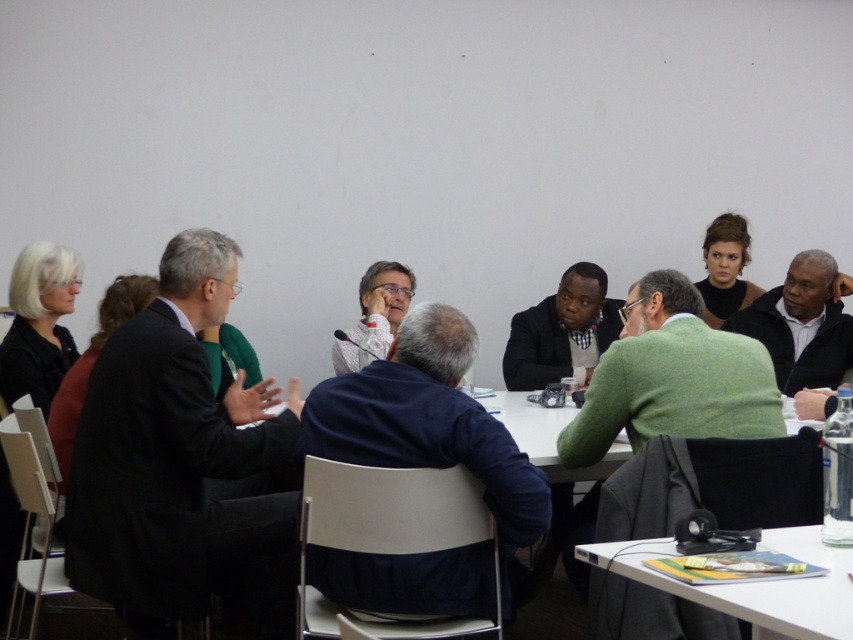
Can you confirm if black suit at left is smaller than white shirt at center?

No, black suit at left is not smaller than white shirt at center.

Between black suit at left and white shirt at center, which one has less height?

white shirt at center is shorter.

Is point (181, 548) farther from viewer compared to point (401, 316)?

No, it is not.

Where is `black suit at left`? The height and width of the screenshot is (640, 853). black suit at left is located at coordinates (180, 458).

Which is more to the left, black suit at left or white plastic table at lower right?

black suit at left

Is black suit at left above white plastic table at lower right?

Yes, black suit at left is above white plastic table at lower right.

Who is more forward, (231, 458) or (839, 564)?

Point (839, 564) is in front.

I want to click on black suit at left, so click(180, 458).

Which is behind, point (828, 612) or point (384, 317)?

The point (384, 317) is behind.

Based on the photo, can you confirm if white plastic table at lower right is wider than white shirt at center?

Correct, the width of white plastic table at lower right exceeds that of white shirt at center.

Which is behind, point (796, 525) or point (364, 284)?

The point (364, 284) is more distant.

The image size is (853, 640). Identify the location of white plastic table at lower right. (752, 582).